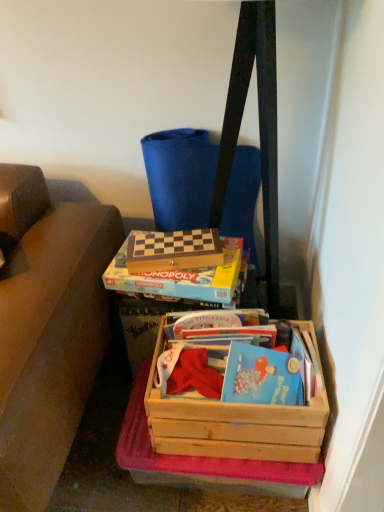
Question: From a real-world perspective, relative to wooden crate at lower right, which is the third box from top to bottom, is wooden chessboard at center, positioned as the 3th box in bottom-to-top order, vertically above or below?

Choices:
 (A) below
 (B) above

Answer: (B)

Question: In the image, is wooden chessboard at center, positioned as the 3th box in bottom-to-top order, on the left side or the right side of wooden crate at lower right, positioned as the first box in bottom-to-top order?

Choices:
 (A) left
 (B) right

Answer: (A)

Question: Which is farther from the wooden monopoly game at center, which appears as the second box when viewed from the top?

Choices:
 (A) wooden messenger bag at upper center
 (B) wooden crate at lower right, which is the third box from top to bottom
 (C) wooden chessboard at center, positioned as the 3th box in bottom-to-top order

Answer: (A)

Question: Estimate the real-world distances between objects in this image. Which object is farther from the wooden monopoly game at center, the 2th box positioned from the bottom?

Choices:
 (A) wooden messenger bag at upper center
 (B) wooden crate at lower right, which is the third box from top to bottom
 (C) wooden chessboard at center, which is the first box from top to bottom

Answer: (A)